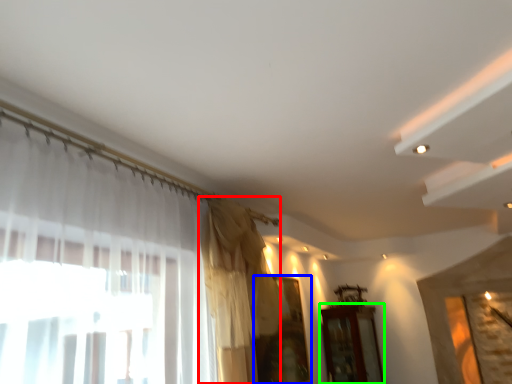
Question: Which object is the closest to the curtain (highlighted by a red box)? Choose among these: window (highlighted by a blue box) or furniture (highlighted by a green box).

Choices:
 (A) window
 (B) furniture

Answer: (A)